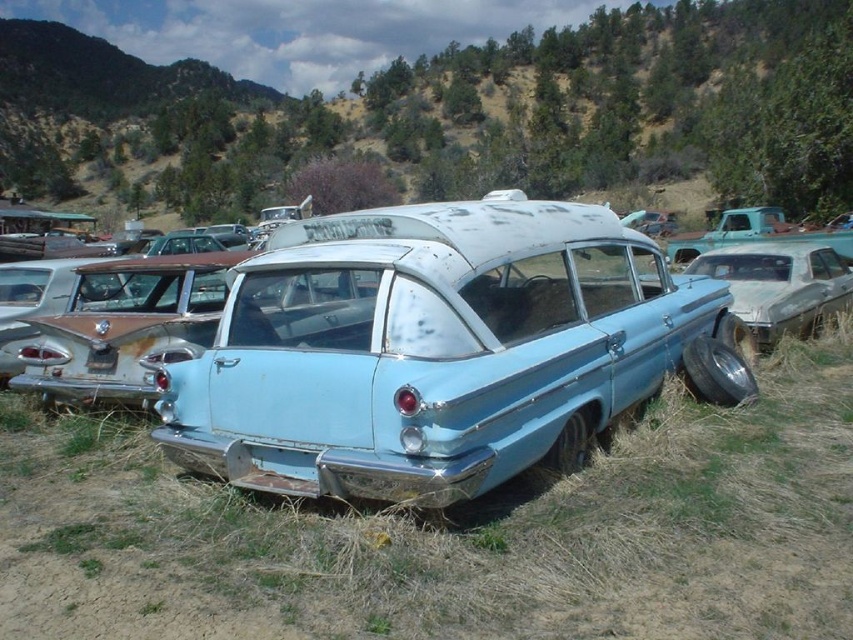
Question: Is rusty metal station wagon at center positioned before teal matte truck at right?

Choices:
 (A) no
 (B) yes

Answer: (B)

Question: Which of the following is the farthest from the observer?

Choices:
 (A) light blue metallic sedan at center
 (B) green grassy hillside at upper center
 (C) light blue metallic station wagon at center

Answer: (B)

Question: Can you confirm if rusty metal station wagon at center is thinner than teal matte truck at right?

Choices:
 (A) yes
 (B) no

Answer: (A)

Question: Which point is closer to the camera?

Choices:
 (A) green grassy hillside at upper center
 (B) rusty metal station wagon at center

Answer: (B)

Question: Which object appears farthest from the camera in this image?

Choices:
 (A) light blue metallic station wagon at center
 (B) rusty metal station wagon at center

Answer: (B)

Question: Does light blue metallic station wagon at center appear on the left side of light blue metallic sedan at center?

Choices:
 (A) no
 (B) yes

Answer: (B)